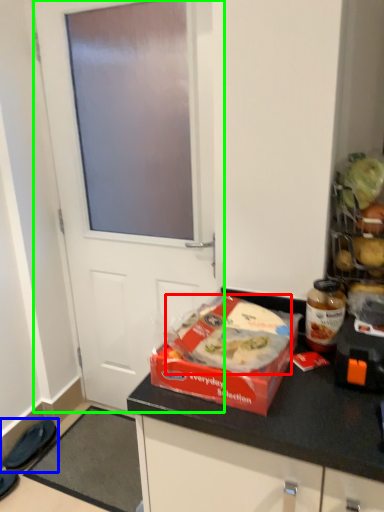
Question: Which is farther away from food (highlighted by a red box)? footwear (highlighted by a blue box) or door (highlighted by a green box)?

Choices:
 (A) footwear
 (B) door

Answer: (A)